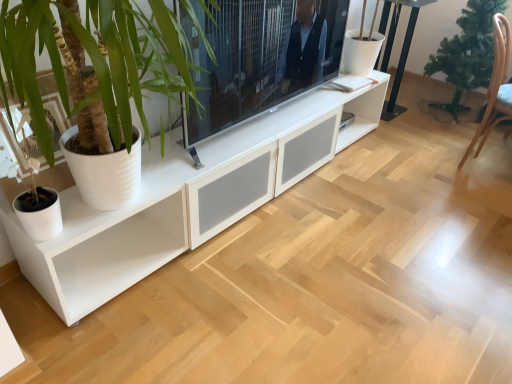
The height and width of the screenshot is (384, 512). Find the location of `free space behind brown wooden armchair at right`. free space behind brown wooden armchair at right is located at coordinates (443, 134).